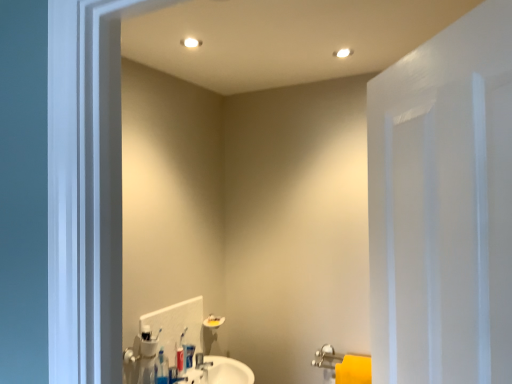
Question: Are matte plastic toothpaste tube at center and white plastic toothbrush at center far apart?

Choices:
 (A) yes
 (B) no

Answer: (B)

Question: From the image's perspective, is matte plastic toothpaste tube at center on top of white plastic toothbrush at center?

Choices:
 (A) no
 (B) yes

Answer: (A)

Question: Does matte plastic toothpaste tube at center have a smaller size compared to white plastic toothbrush at center?

Choices:
 (A) yes
 (B) no

Answer: (B)

Question: Considering the relative positions of matte plastic toothpaste tube at center and white plastic toothbrush at center in the image provided, is matte plastic toothpaste tube at center to the left of white plastic toothbrush at center from the viewer's perspective?

Choices:
 (A) no
 (B) yes

Answer: (A)

Question: Considering the relative sizes of matte plastic toothpaste tube at center and white plastic toothbrush at center in the image provided, is matte plastic toothpaste tube at center bigger than white plastic toothbrush at center?

Choices:
 (A) yes
 (B) no

Answer: (A)

Question: Is matte plastic toothpaste tube at center turned away from white plastic toothbrush at center?

Choices:
 (A) yes
 (B) no

Answer: (B)

Question: Is matte silver faucet at center wider than matte plastic toothpaste tube at center?

Choices:
 (A) yes
 (B) no

Answer: (A)

Question: Is matte silver faucet at center bigger than matte plastic toothpaste tube at center?

Choices:
 (A) yes
 (B) no

Answer: (A)

Question: From the image's perspective, is matte silver faucet at center located above matte plastic toothpaste tube at center?

Choices:
 (A) no
 (B) yes

Answer: (A)

Question: Considering the relative sizes of matte silver faucet at center and matte plastic toothpaste tube at center in the image provided, is matte silver faucet at center thinner than matte plastic toothpaste tube at center?

Choices:
 (A) yes
 (B) no

Answer: (B)

Question: Can you confirm if matte silver faucet at center is shorter than matte plastic toothpaste tube at center?

Choices:
 (A) no
 (B) yes

Answer: (B)

Question: Is matte silver faucet at center aimed at matte plastic toothpaste tube at center?

Choices:
 (A) yes
 (B) no

Answer: (B)

Question: Considering the relative sizes of matte plastic toothpaste tube at center and white painted wood door at right in the image provided, is matte plastic toothpaste tube at center smaller than white painted wood door at right?

Choices:
 (A) no
 (B) yes

Answer: (B)